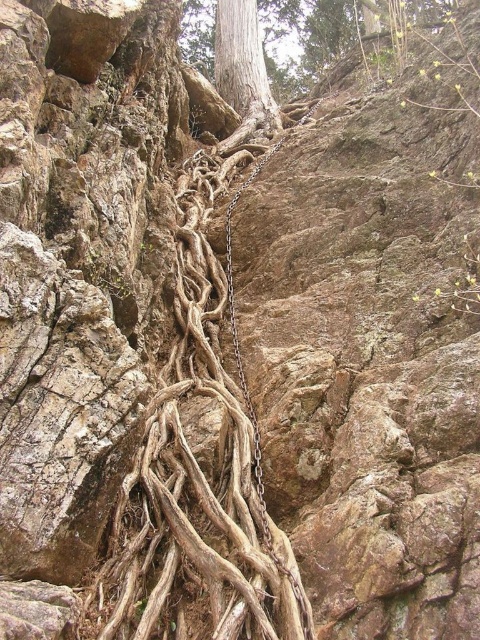
You are a hiker trying to climb up the rocky terrain. You notice the brown rough tree roots at center and the metallic chain at center. Which one takes up more space in the area?

The metallic chain at center takes up more space than the brown rough tree roots at center.

You are a hiker trying to climb up the rocky terrain. You notice the brown rough tree roots at center and the smooth gray tree trunk at upper center. Which object is shorter in height?

The brown rough tree roots at center has a lesser height compared to the smooth gray tree trunk at upper center, so the brown rough tree roots at center is shorter in height.